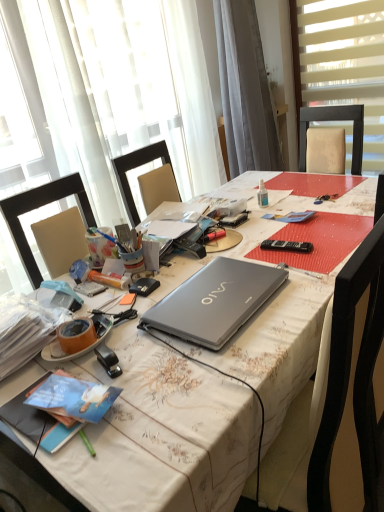
The height and width of the screenshot is (512, 384). I want to click on free space behind blue matte book at lower left, which is counted as the 2th book, starting from the top, so click(x=69, y=365).